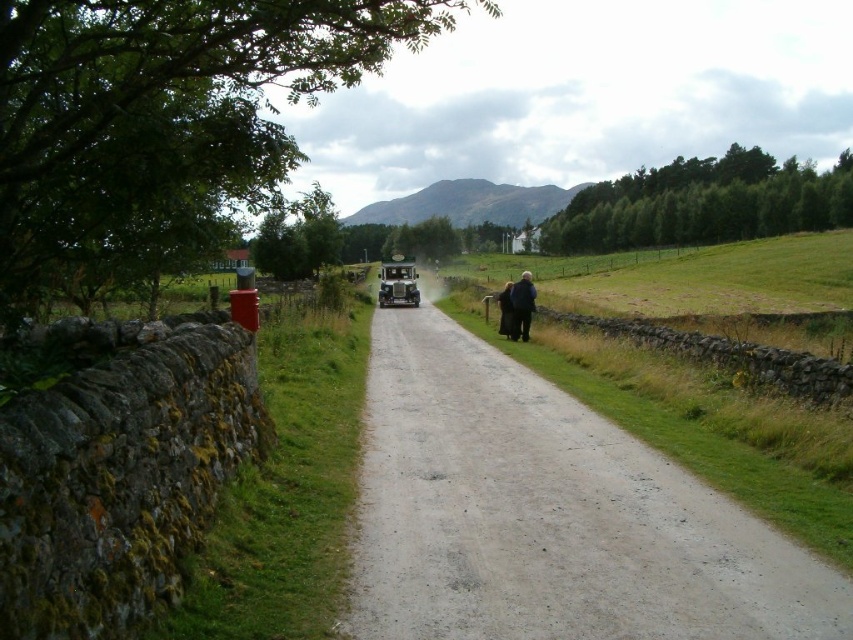
You are a hiker who wants to cross the road without getting your shoes dirty. You see the dusty gravel road at center and the dark brown wool coat at right. Which object can you step on to avoid getting dirty?

The dark brown wool coat at right is smaller in size than the dusty gravel road at center, so stepping on the dark brown wool coat at right would not be advisable. Instead, you should avoid both and find a cleaner path.